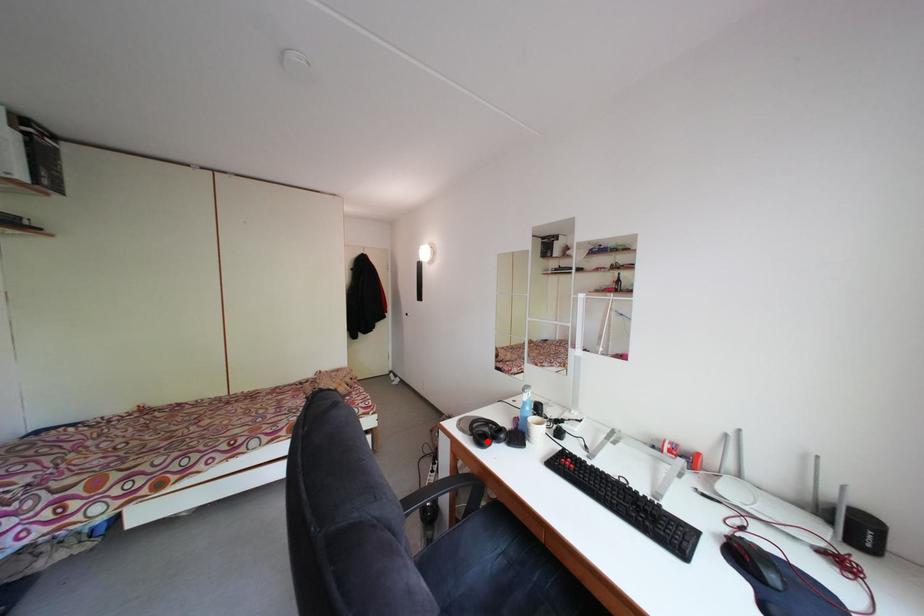
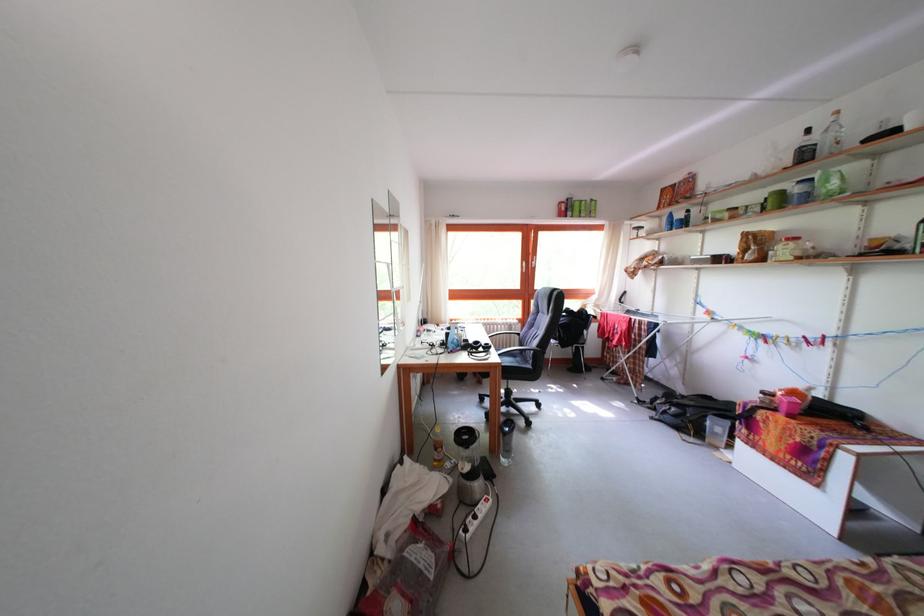
Find the pixel in the second image that matches the highlighted location in the first image.

(495, 353)